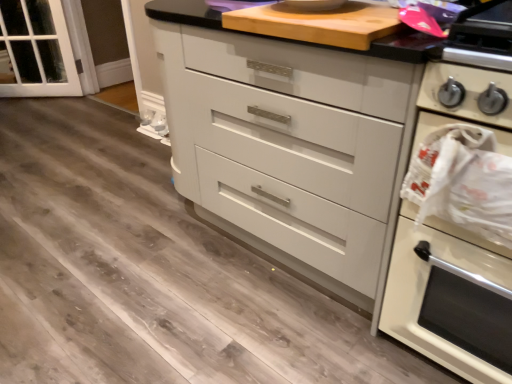
Question: Is white glossy oven at right in front of wooden cutting board at upper center?

Choices:
 (A) yes
 (B) no

Answer: (A)

Question: Does white glossy oven at right appear on the left side of wooden cutting board at upper center?

Choices:
 (A) no
 (B) yes

Answer: (A)

Question: Considering the relative sizes of white glossy oven at right and wooden cutting board at upper center in the image provided, is white glossy oven at right smaller than wooden cutting board at upper center?

Choices:
 (A) yes
 (B) no

Answer: (B)

Question: Does white glossy oven at right have a greater height compared to wooden cutting board at upper center?

Choices:
 (A) no
 (B) yes

Answer: (B)

Question: Is there a large distance between white glossy oven at right and wooden cutting board at upper center?

Choices:
 (A) no
 (B) yes

Answer: (A)

Question: Is white glossy oven at right oriented towards wooden cutting board at upper center?

Choices:
 (A) yes
 (B) no

Answer: (B)

Question: Considering the relative sizes of wooden cutting board at upper center and white glossy chest of drawers at center in the image provided, is wooden cutting board at upper center taller than white glossy chest of drawers at center?

Choices:
 (A) no
 (B) yes

Answer: (A)

Question: Can we say wooden cutting board at upper center lies outside white glossy chest of drawers at center?

Choices:
 (A) no
 (B) yes

Answer: (A)

Question: Does wooden cutting board at upper center lie behind white glossy chest of drawers at center?

Choices:
 (A) no
 (B) yes

Answer: (B)

Question: Is wooden cutting board at upper center wider than white glossy chest of drawers at center?

Choices:
 (A) no
 (B) yes

Answer: (A)

Question: From the image's perspective, would you say wooden cutting board at upper center is positioned over white glossy chest of drawers at center?

Choices:
 (A) no
 (B) yes

Answer: (B)

Question: Could you tell me if wooden cutting board at upper center is turned towards white glossy chest of drawers at center?

Choices:
 (A) yes
 (B) no

Answer: (A)

Question: Can you confirm if clear glass door at left is shorter than white glossy chest of drawers at center?

Choices:
 (A) no
 (B) yes

Answer: (B)